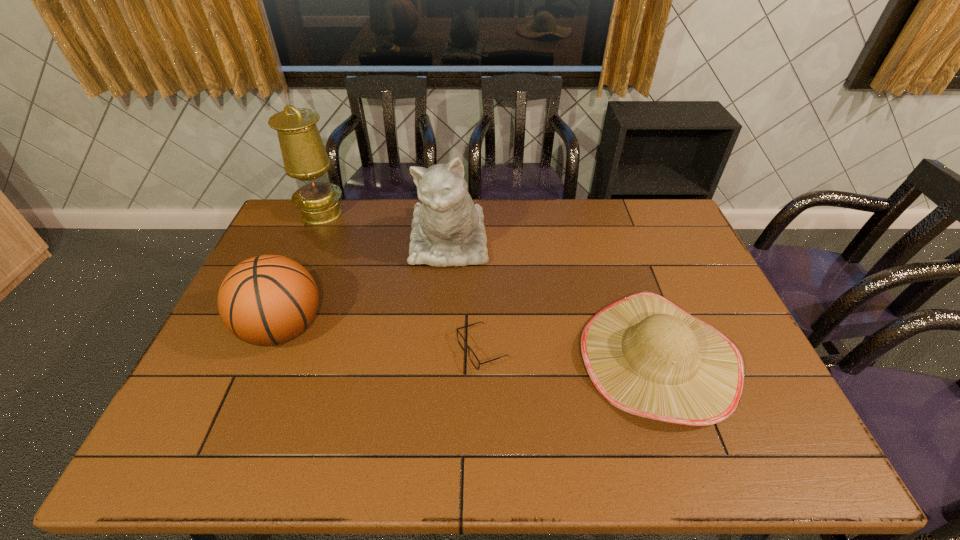
Locate an element on the screen. blank area located with the lenses facing outward on the shortest object is located at coordinates (408, 350).

Where is `blank space located with the lenses facing outward on the shortest object`? The width and height of the screenshot is (960, 540). blank space located with the lenses facing outward on the shortest object is located at coordinates (361, 350).

This screenshot has height=540, width=960. I want to click on free space located with the lenses facing outward on the shortest object, so click(416, 350).

Identify the location of oil lamp situated at the far edge. The width and height of the screenshot is (960, 540). (305, 158).

Locate an element on the screen. The width and height of the screenshot is (960, 540). cat present at the far edge is located at coordinates (447, 228).

You are a GUI agent. You are given a task and a screenshot of the screen. Output one action in this format:
    pyautogui.click(x=<x>, y=<y>)
    Task: Click on the object at the near edge
    This screenshot has width=960, height=540.
    Given the screenshot: What is the action you would take?
    pyautogui.click(x=645, y=355)

The image size is (960, 540). Identify the location of oil lamp present at the left edge. [305, 158].

This screenshot has height=540, width=960. I want to click on basketball that is at the left edge, so click(x=267, y=300).

What are the coordinates of `object located at the right edge` in the screenshot? It's located at (645, 355).

This screenshot has height=540, width=960. I want to click on object that is at the far left corner, so click(x=305, y=158).